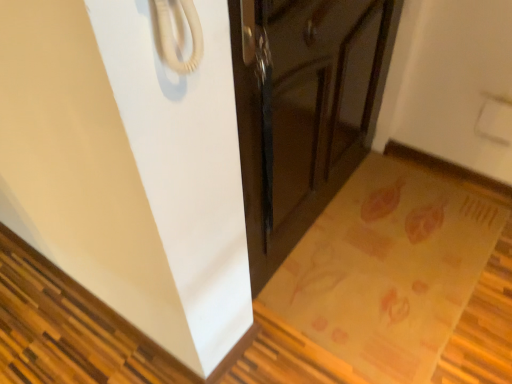
In order to face yellowish-brown textured mat at lower right, should I rotate leftwards or rightwards?

Turn right approximately 18.294 degrees to face it.

This screenshot has width=512, height=384. I want to click on yellowish-brown textured mat at lower right, so click(x=388, y=269).

What do you see at coordinates (388, 269) in the screenshot? The height and width of the screenshot is (384, 512). I see `yellowish-brown textured mat at lower right` at bounding box center [388, 269].

What do you see at coordinates (303, 110) in the screenshot?
I see `glossy dark wood cabinet at center` at bounding box center [303, 110].

Locate an element on the screen. The width and height of the screenshot is (512, 384). glossy dark wood cabinet at center is located at coordinates (303, 110).

I want to click on yellowish-brown textured mat at lower right, so click(388, 269).

Is glossy dark wood cabinet at center at the right side of yellowish-brown textured mat at lower right?

In fact, glossy dark wood cabinet at center is to the left of yellowish-brown textured mat at lower right.

Relative to yellowish-brown textured mat at lower right, is glossy dark wood cabinet at center in front or behind?

Clearly, glossy dark wood cabinet at center is in front of yellowish-brown textured mat at lower right.

Which is in front, point (343, 74) or point (335, 244)?

Positioned in front is point (343, 74).

From the image's perspective, who appears lower, glossy dark wood cabinet at center or yellowish-brown textured mat at lower right?

yellowish-brown textured mat at lower right appears lower in the image.

From a real-world perspective, which is physically below, glossy dark wood cabinet at center or yellowish-brown textured mat at lower right?

In real-world perspective, yellowish-brown textured mat at lower right is lower.

Considering the sizes of objects glossy dark wood cabinet at center and yellowish-brown textured mat at lower right in the image provided, who is wider, glossy dark wood cabinet at center or yellowish-brown textured mat at lower right?

yellowish-brown textured mat at lower right.

Between glossy dark wood cabinet at center and yellowish-brown textured mat at lower right, which one has less height?

yellowish-brown textured mat at lower right is shorter.

Considering the relative sizes of glossy dark wood cabinet at center and yellowish-brown textured mat at lower right in the image provided, is glossy dark wood cabinet at center smaller than yellowish-brown textured mat at lower right?

No, glossy dark wood cabinet at center is not smaller than yellowish-brown textured mat at lower right.

Do you think glossy dark wood cabinet at center is within yellowish-brown textured mat at lower right, or outside of it?

glossy dark wood cabinet at center is not inside yellowish-brown textured mat at lower right, it's outside.

Is glossy dark wood cabinet at center far from yellowish-brown textured mat at lower right?

No, glossy dark wood cabinet at center is not far from yellowish-brown textured mat at lower right.

Is glossy dark wood cabinet at center facing towards yellowish-brown textured mat at lower right?

Yes, glossy dark wood cabinet at center is facing yellowish-brown textured mat at lower right.

Can you tell me how much glossy dark wood cabinet at center and yellowish-brown textured mat at lower right differ in facing direction?

The facing directions of glossy dark wood cabinet at center and yellowish-brown textured mat at lower right are 2.57 degrees apart.

There is a yellowish-brown textured mat at lower right. Identify the location of cabinetry above it (from a real-world perspective). (303, 110).

Visually, is yellowish-brown textured mat at lower right positioned to the left or to the right of glossy dark wood cabinet at center?

In the image, yellowish-brown textured mat at lower right appears on the right side of glossy dark wood cabinet at center.

Is yellowish-brown textured mat at lower right positioned behind glossy dark wood cabinet at center?

Yes.

Considering the points (345, 204) and (261, 226), which point is behind, point (345, 204) or point (261, 226)?

The point (345, 204) is more distant.

From the image's perspective, does yellowish-brown textured mat at lower right appear higher than glossy dark wood cabinet at center?

No.

From a real-world perspective, is yellowish-brown textured mat at lower right physically above glossy dark wood cabinet at center?

No, from a real-world perspective, yellowish-brown textured mat at lower right is not on top of glossy dark wood cabinet at center.

Which of these two, yellowish-brown textured mat at lower right or glossy dark wood cabinet at center, is wider?

Wider between the two is yellowish-brown textured mat at lower right.

Considering the sizes of yellowish-brown textured mat at lower right and glossy dark wood cabinet at center in the image, is yellowish-brown textured mat at lower right taller or shorter than glossy dark wood cabinet at center?

yellowish-brown textured mat at lower right is shorter than glossy dark wood cabinet at center.

Which of these two, yellowish-brown textured mat at lower right or glossy dark wood cabinet at center, is bigger?

glossy dark wood cabinet at center is bigger.

Is yellowish-brown textured mat at lower right situated inside glossy dark wood cabinet at center or outside?

yellowish-brown textured mat at lower right is located beyond the bounds of glossy dark wood cabinet at center.

Is yellowish-brown textured mat at lower right directly adjacent to glossy dark wood cabinet at center?

No, yellowish-brown textured mat at lower right is not touching glossy dark wood cabinet at center.

Is glossy dark wood cabinet at center at the back of yellowish-brown textured mat at lower right?

No, yellowish-brown textured mat at lower right's orientation is not away from glossy dark wood cabinet at center.

Looking at this image, how much distance is there between yellowish-brown textured mat at lower right and glossy dark wood cabinet at center?

A distance of 15.76 inches exists between yellowish-brown textured mat at lower right and glossy dark wood cabinet at center.

This screenshot has width=512, height=384. There is a yellowish-brown textured mat at lower right. Identify the location of cabinetry above it (from a real-world perspective). (303, 110).

What are the coordinates of `mat on the right of glossy dark wood cabinet at center` in the screenshot? It's located at (388, 269).

In the image, there is a glossy dark wood cabinet at center. Where is `mat below it (from a real-world perspective)`? mat below it (from a real-world perspective) is located at coordinates (388, 269).